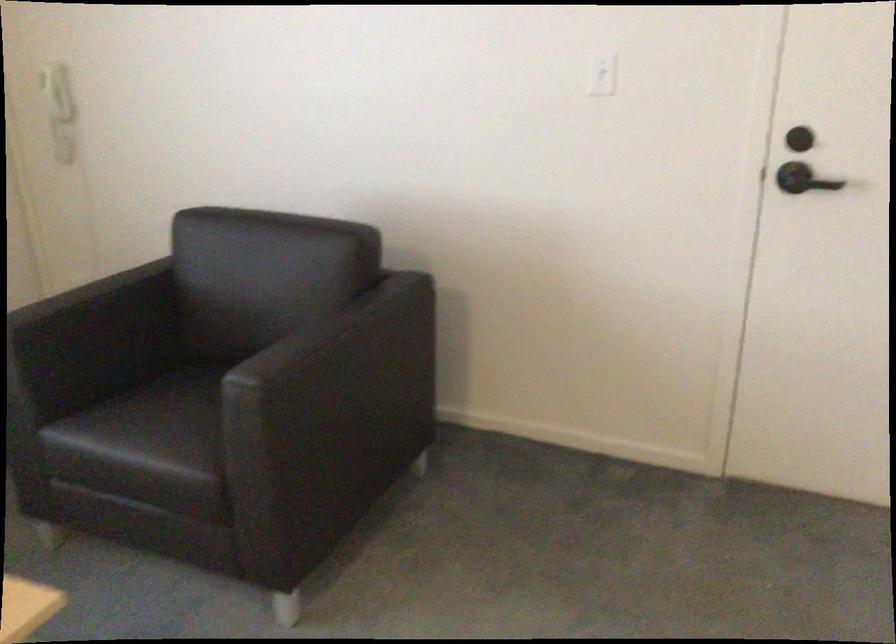
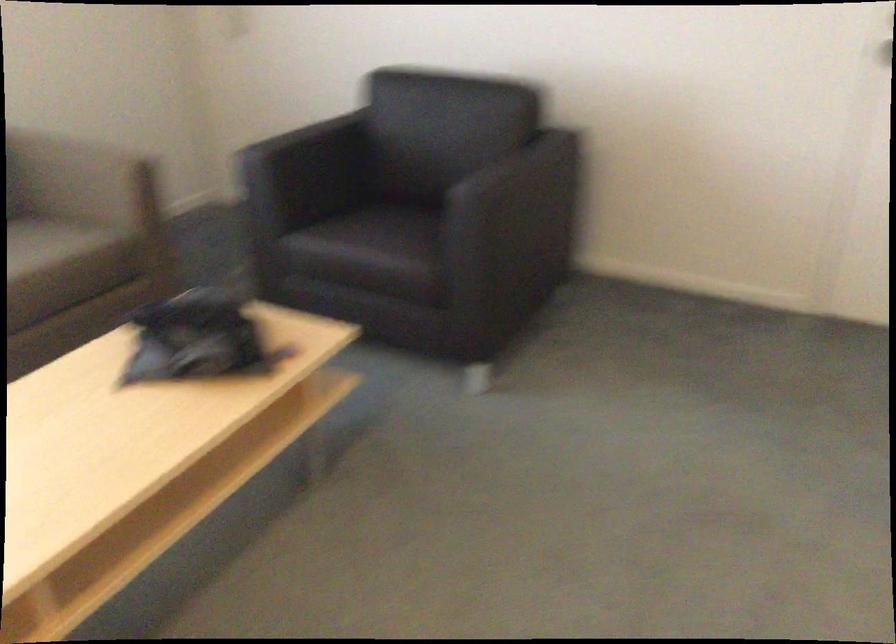
Where in the second image is the point corresponding to (x=73, y=308) from the first image?

(304, 138)